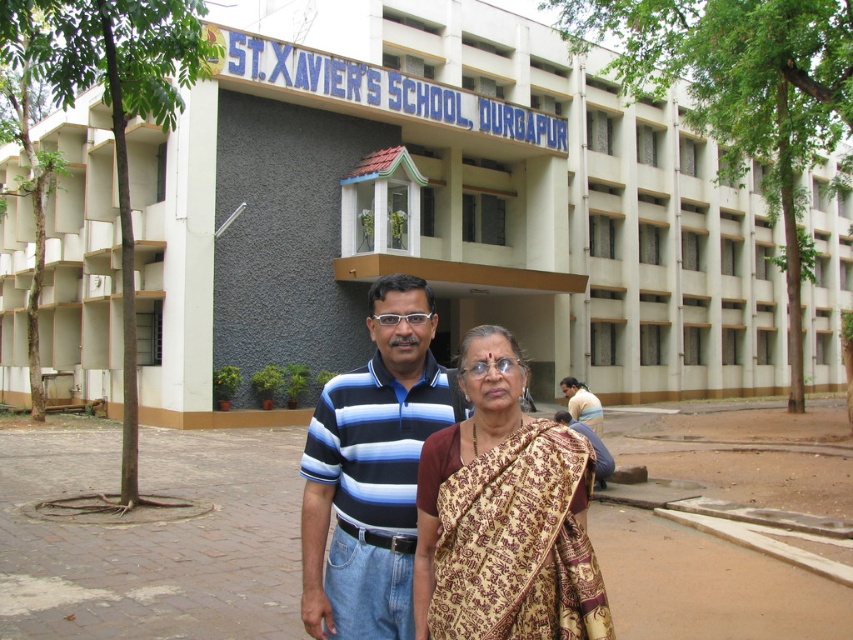
Is brown silk saree at center closer to camera compared to light brown fabric shirt at lower right?

Yes, it is.

This screenshot has height=640, width=853. What are the coordinates of `brown silk saree at center` in the screenshot? It's located at (503, 515).

Does gray concrete building at center appear on the right side of light brown fabric shirt at lower right?

Correct, you'll find gray concrete building at center to the right of light brown fabric shirt at lower right.

Between gray concrete building at center and light brown fabric shirt at lower right, which one is positioned lower?

light brown fabric shirt at lower right is lower down.

Between point (660, 396) and point (587, 410), which one is positioned in front?

Point (587, 410)

This screenshot has width=853, height=640. I want to click on gray concrete building at center, so click(440, 209).

Who is positioned more to the right, gray concrete building at center or striped cotton shirt at center?

From the viewer's perspective, gray concrete building at center appears more on the right side.

Find the location of a particular element. This screenshot has width=853, height=640. gray concrete building at center is located at coordinates (440, 209).

Is point (465, 216) positioned behind point (389, 305)?

Yes, point (465, 216) is behind point (389, 305).

Where is `gray concrete building at center`? This screenshot has width=853, height=640. gray concrete building at center is located at coordinates (440, 209).